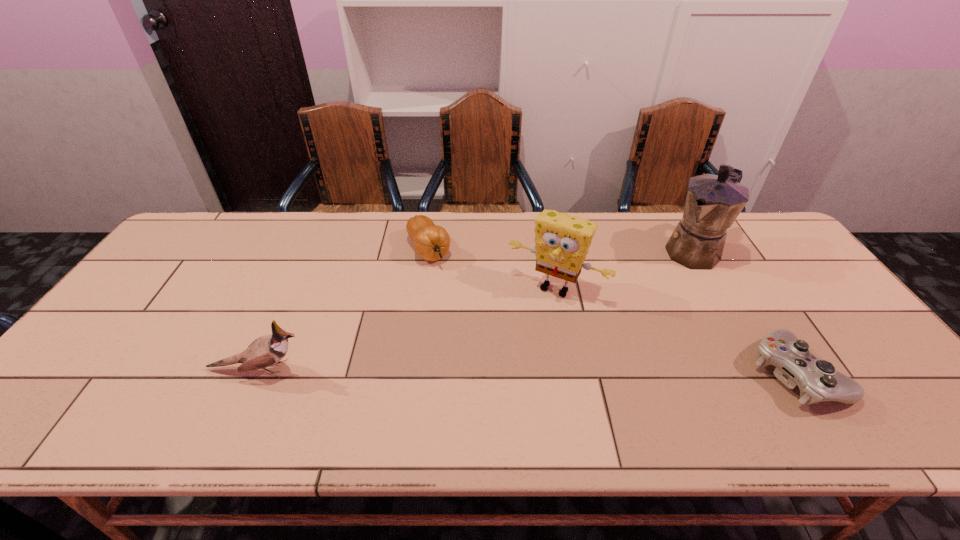
Identify the location of free space located 0.120m on the face of the fourth shortest object. Image resolution: width=960 pixels, height=540 pixels. (518, 334).

Find the location of `vacant region located on the face of the fourth shortest object`. vacant region located on the face of the fourth shortest object is located at coordinates (510, 348).

This screenshot has height=540, width=960. I want to click on vacant position located 0.280m on the face of the fourth shortest object, so click(x=490, y=381).

This screenshot has height=540, width=960. I want to click on free space located on the stem side of the fourth object from right to left, so click(x=496, y=356).

Image resolution: width=960 pixels, height=540 pixels. I want to click on free space located on the stem side of the fourth object from right to left, so click(485, 340).

Locate an element on the screen. This screenshot has height=540, width=960. vacant space located on the stem side of the fourth object from right to left is located at coordinates (487, 342).

In order to click on free spot located 0.300m on the pouring side of the tallest object in this screenshot , I will do `click(625, 315)`.

Where is `free spot located on the pouring side of the tallest object`? The height and width of the screenshot is (540, 960). free spot located on the pouring side of the tallest object is located at coordinates (672, 272).

Locate an element on the screen. vacant region located on the pouring side of the tallest object is located at coordinates (645, 296).

This screenshot has width=960, height=540. I want to click on gourd that is at the far edge, so click(x=431, y=242).